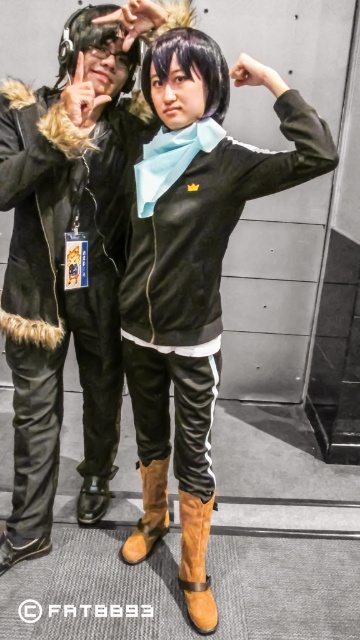
You are standing in the convention hall and see the leather jacket at left and the brown suede boot at lower center. Which object is positioned to the left of the other?

The leather jacket at left is to the left of the brown suede boot at lower center.

You are a photographer at the event and need to adjust the camera angle to ensure both the leather jacket at left and the suede boot at lower center are fully visible. Given their heights, which object should you focus on to frame the shot appropriately?

The leather jacket at left is taller than the suede boot at lower center, so you should focus on framing the shot around the height of the leather jacket at left to ensure both objects are fully visible.

You are standing in front of the two people in the image. Which object is nearer to you, the leather jacket at left or the suede boot at lower center?

The leather jacket at left is closer to the viewer than the suede boot at lower center.